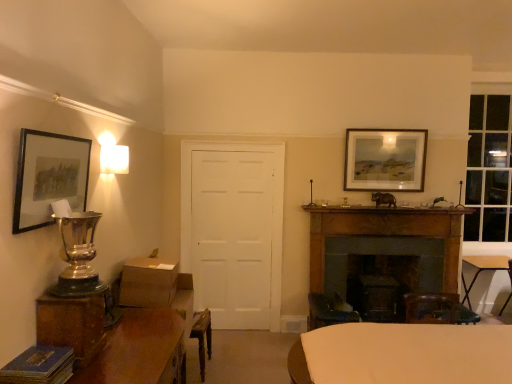
The image size is (512, 384). In order to click on matte black picture frame at upper left, which ranks as the 2th picture frame in back-to-front order in this screenshot , I will do `click(49, 177)`.

Image resolution: width=512 pixels, height=384 pixels. What do you see at coordinates (385, 265) in the screenshot?
I see `dark brown wood fireplace at center right` at bounding box center [385, 265].

Identify the location of dark brown wood fireplace at center right. Image resolution: width=512 pixels, height=384 pixels. click(385, 265).

What do you see at coordinates (234, 230) in the screenshot? I see `white matte door at center` at bounding box center [234, 230].

In order to face white fabric-covered table at center, the 2th table positioned from the left, should I rotate leftwards or rightwards?

You should rotate right by 21.709 degrees.

What is the approximate width of white fabric-covered table at center, the second table in the front-to-back sequence?

white fabric-covered table at center, the second table in the front-to-back sequence, is 38.46 inches in width.

Identify the location of wooden table at lower left, the third table viewed from the right. (138, 351).

At what (x,y) coordinates should I click in order to perform the action: click on wooden folding table at lower right, the 1th table from the back. Please return your answer as a coordinate pair (x, y). The width and height of the screenshot is (512, 384). Looking at the image, I should click on (482, 269).

Could white matte door at center be considered to be inside dark brown wood fireplace at center right?

Definitely not — white matte door at center is not inside dark brown wood fireplace at center right.

From the picture: What's the angular difference between dark brown wood fireplace at center right and white matte door at center's facing directions?

There is a 1.99-degree angle between the facing directions of dark brown wood fireplace at center right and white matte door at center.

Does dark brown wood fireplace at center right have a lesser width compared to white matte door at center?

Correct, the width of dark brown wood fireplace at center right is less than that of white matte door at center.

Can you confirm if dark brown wood fireplace at center right is bigger than white matte door at center?

No, dark brown wood fireplace at center right is not bigger than white matte door at center.

In terms of width, does matte black picture frame at upper left, marked as the second picture frame in a right-to-left arrangement, look wider or thinner when compared to silver metallic trophy at left?

Considering their sizes, matte black picture frame at upper left, marked as the second picture frame in a right-to-left arrangement, looks slimmer than silver metallic trophy at left.

From the image's perspective, does matte black picture frame at upper left, which is the first picture frame from left to right, appear lower than silver metallic trophy at left?

No, from the image's perspective, matte black picture frame at upper left, which is the first picture frame from left to right, is not beneath silver metallic trophy at left.

Is point (27, 194) less distant than point (70, 276)?

Yes, point (27, 194) is closer to viewer.

Is matte black picture frame at upper left, the 1th picture frame viewed from the front, at the left side of silver metallic trophy at left?

Correct, you'll find matte black picture frame at upper left, the 1th picture frame viewed from the front, to the left of silver metallic trophy at left.

From the image's perspective, does white fabric-covered table at center, the 2th table positioned from the left, appear higher than wooden table at lower left, the third table viewed from the right?

No, from the image's perspective, white fabric-covered table at center, the 2th table positioned from the left, is not over wooden table at lower left, the third table viewed from the right.

Which point is more distant from viewer, (432, 366) or (142, 322)?

The point (142, 322) is behind.

Considering the sizes of objects white fabric-covered table at center, placed as the second table when sorted from back to front, and wooden table at lower left, arranged as the 3th table when viewed from the back, in the image provided, who is shorter, white fabric-covered table at center, placed as the second table when sorted from back to front, or wooden table at lower left, arranged as the 3th table when viewed from the back,?

With less height is white fabric-covered table at center, placed as the second table when sorted from back to front.

Is matte black picture frame at upper left, the 1th picture frame viewed from the front, at the left side of wooden folding table at lower right, which appears as the 3th table when viewed from the front?

Correct, you'll find matte black picture frame at upper left, the 1th picture frame viewed from the front, to the left of wooden folding table at lower right, which appears as the 3th table when viewed from the front.

From the image's perspective, which object appears higher, matte black picture frame at upper left, marked as the second picture frame in a right-to-left arrangement, or wooden folding table at lower right, the 1th table from the back?

matte black picture frame at upper left, marked as the second picture frame in a right-to-left arrangement.

Could you tell me if matte black picture frame at upper left, marked as the second picture frame in a right-to-left arrangement, is facing wooden folding table at lower right, which ranks as the 1th table in right-to-left order?

No, matte black picture frame at upper left, marked as the second picture frame in a right-to-left arrangement, does not turn towards wooden folding table at lower right, which ranks as the 1th table in right-to-left order.

Would you say matte black picture frame at upper left, the 1th picture frame viewed from the front, is inside or outside wooden folding table at lower right, which appears as the 3th table when viewed from the front?

matte black picture frame at upper left, the 1th picture frame viewed from the front, is not enclosed by wooden folding table at lower right, which appears as the 3th table when viewed from the front.

Which of these two, wooden table at lower left, arranged as the first table when viewed from the front, or white fabric-covered table at center, placed as the second table when sorted from back to front, is wider?

white fabric-covered table at center, placed as the second table when sorted from back to front, is wider.

How far apart are wooden table at lower left, the third table viewed from the right, and white fabric-covered table at center, the 2th table positioned from the left?

They are 1.11 meters apart.

Consider the image. From a real-world perspective, is wooden table at lower left, arranged as the first table when viewed from the front, under white fabric-covered table at center, which is counted as the 2th table, starting from the right?

Actually, wooden table at lower left, arranged as the first table when viewed from the front, is physically above white fabric-covered table at center, which is counted as the 2th table, starting from the right, in the real world.

How many degrees apart are the facing directions of wooden table at lower left, arranged as the 3th table when viewed from the back, and white fabric-covered table at center, the 2th table positioned from the left?

91.3 degrees separate the facing orientations of wooden table at lower left, arranged as the 3th table when viewed from the back, and white fabric-covered table at center, the 2th table positioned from the left.

Is dark brown wood fireplace at center right completely or partially outside of wooden table at lower left, arranged as the first table when viewed from the front?

Yes, dark brown wood fireplace at center right is located beyond the bounds of wooden table at lower left, arranged as the first table when viewed from the front.

From the image's perspective, does dark brown wood fireplace at center right appear lower than wooden table at lower left, arranged as the 3th table when viewed from the back?

No, from the image's perspective, dark brown wood fireplace at center right is not beneath wooden table at lower left, arranged as the 3th table when viewed from the back.

This screenshot has height=384, width=512. In order to click on fireplace behind the wooden table at lower left, arranged as the 3th table when viewed from the back in this screenshot , I will do `click(385, 265)`.

Considering the sizes of objects dark brown wood fireplace at center right and wooden table at lower left, the third table viewed from the right, in the image provided, who is smaller, dark brown wood fireplace at center right or wooden table at lower left, the third table viewed from the right,?

Smaller between the two is dark brown wood fireplace at center right.

Who is smaller, matte black picture frame at upper left, which is the first picture frame from left to right, or wooden table at lower left, arranged as the first table when viewed from the front?

matte black picture frame at upper left, which is the first picture frame from left to right.

From the image's perspective, which is below, matte black picture frame at upper left, the 1th picture frame viewed from the front, or wooden table at lower left, arranged as the first table when viewed from the front?

From the image's view, wooden table at lower left, arranged as the first table when viewed from the front, is below.

Would you say wooden table at lower left, arranged as the 3th table when viewed from the back, is part of matte black picture frame at upper left, which is the first picture frame from left to right,'s contents?

No, wooden table at lower left, arranged as the 3th table when viewed from the back, is not inside matte black picture frame at upper left, which is the first picture frame from left to right.

Locate an element on the screen. The height and width of the screenshot is (384, 512). the 1st picture frame positioned above the wooden table at lower left, arranged as the 3th table when viewed from the back (from the image's perspective) is located at coordinates (49, 177).

The image size is (512, 384). What are the coordinates of `fireplace on the right of white matte door at center` in the screenshot? It's located at tap(385, 265).

This screenshot has height=384, width=512. I want to click on table lamp behind the matte black picture frame at upper left, which is the first picture frame from left to right, so click(77, 256).

Based on their spatial positions, is matte black picture frame at upper left, the 1th picture frame viewed from the front, or white matte door at center further from matte wooden picture frame at upper right, which is the first picture frame from back to front?

matte black picture frame at upper left, the 1th picture frame viewed from the front, is further to matte wooden picture frame at upper right, which is the first picture frame from back to front.

Which object lies further to the anchor point dark brown wood fireplace at center right, matte black picture frame at upper left, the 1th picture frame viewed from the front, or white fabric-covered table at center, the second table in the front-to-back sequence?

Among the two, matte black picture frame at upper left, the 1th picture frame viewed from the front, is located further to dark brown wood fireplace at center right.

Based on their spatial positions, is silver metallic trophy at left or matte wooden picture frame at upper right, the first picture frame in the right-to-left sequence, closer to wooden table at lower left, arranged as the first table when viewed from the front?

silver metallic trophy at left lies closer to wooden table at lower left, arranged as the first table when viewed from the front, than the other object.

Based on their spatial positions, is matte black picture frame at upper left, which is the first picture frame from left to right, or silver metallic trophy at left further from matte wooden picture frame at upper right, the 2th picture frame from the front?

Based on the image, matte black picture frame at upper left, which is the first picture frame from left to right, appears to be further to matte wooden picture frame at upper right, the 2th picture frame from the front.

Which object lies further to the anchor point white matte door at center, white fabric-covered table at center, which is counted as the 2th table, starting from the right, or dark brown wood fireplace at center right?

white fabric-covered table at center, which is counted as the 2th table, starting from the right.

From the picture: From the image, which object appears to be nearer to white matte door at center, matte black picture frame at upper left, the 1th picture frame viewed from the front, or white fabric-covered table at center, placed as the second table when sorted from back to front?

Among the two, white fabric-covered table at center, placed as the second table when sorted from back to front, is located nearer to white matte door at center.

When comparing their distances from dark brown wood fireplace at center right, does silver metallic trophy at left or white matte door at center seem further?

silver metallic trophy at left.

When comparing their distances from silver metallic trophy at left, does matte wooden picture frame at upper right, marked as the 2th picture frame in a left-to-right arrangement, or wooden folding table at lower right, which ranks as the 1th table in right-to-left order, seem further?

Among the two, wooden folding table at lower right, which ranks as the 1th table in right-to-left order, is located further to silver metallic trophy at left.

Where is `table lamp between matte black picture frame at upper left, which ranks as the 2th picture frame in back-to-front order, and white fabric-covered table at center, placed as the second table when sorted from back to front, from left to right`? table lamp between matte black picture frame at upper left, which ranks as the 2th picture frame in back-to-front order, and white fabric-covered table at center, placed as the second table when sorted from back to front, from left to right is located at coordinates (77, 256).

At what (x,y) coordinates should I click in order to perform the action: click on table located between silver metallic trophy at left and white fabric-covered table at center, which is counted as the 2th table, starting from the right, in the left-right direction. Please return your answer as a coordinate pair (x, y). Looking at the image, I should click on (138, 351).

What are the coordinates of `table lamp between wooden table at lower left, the 1th table positioned from the left, and white matte door at center in the front-back direction` in the screenshot? It's located at (77, 256).

This screenshot has height=384, width=512. Find the location of `table lamp between wooden table at lower left, arranged as the first table when viewed from the front, and matte wooden picture frame at upper right, marked as the 2th picture frame in a left-to-right arrangement, in the front-back direction`. table lamp between wooden table at lower left, arranged as the first table when viewed from the front, and matte wooden picture frame at upper right, marked as the 2th picture frame in a left-to-right arrangement, in the front-back direction is located at coordinates (77, 256).